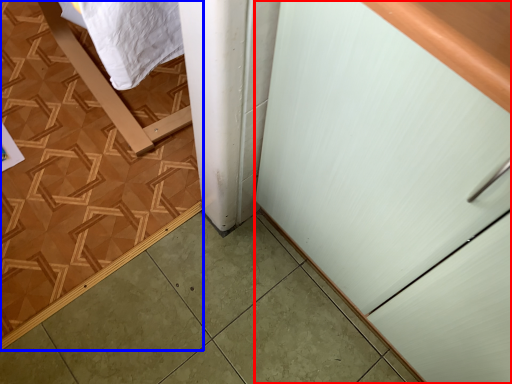
Question: Among these objects, which one is farthest to the camera, cabinetry (highlighted by a red box) or ceramic tile (highlighted by a blue box)?

Choices:
 (A) cabinetry
 (B) ceramic tile

Answer: (B)